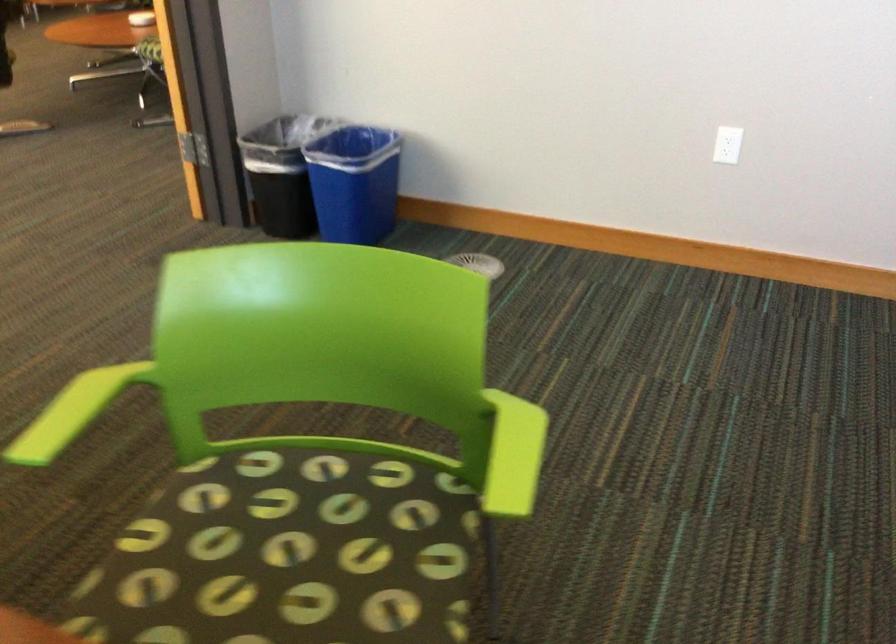
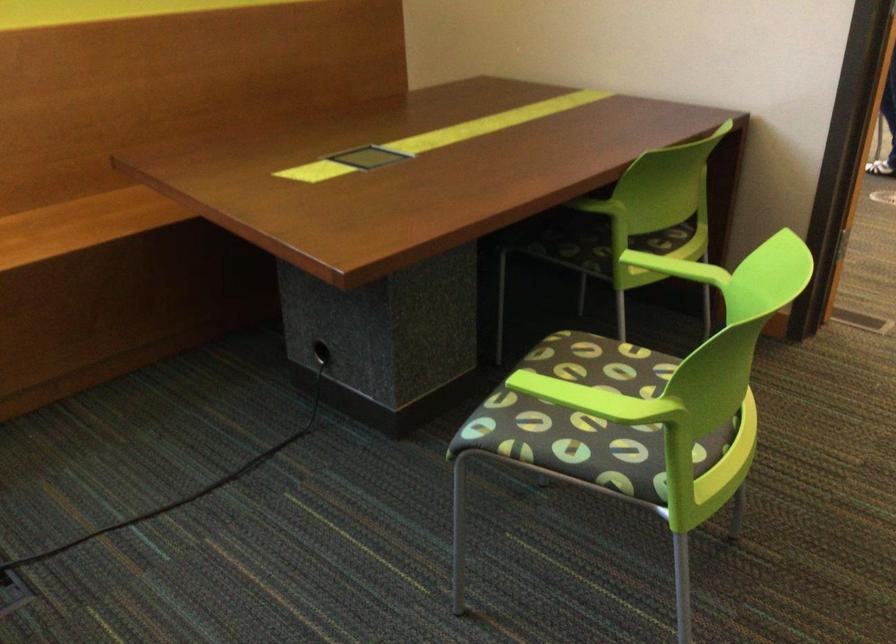
Question: I am providing you with two images of the same scene from different viewpoints. After the viewpoint changes to image2, which objects are now occluded?

Choices:
 (A) green spatula
 (B) chair sitting surface
 (C) patterned chair sitting surface
 (D) green chair armrest

Answer: (B)